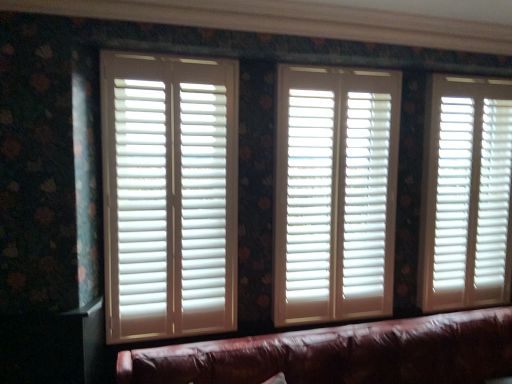
Question: Considering the relative sizes of white matte blinds at left, which appears as the third window blind when viewed from the right, and white matte blinds at right, which is the third window blind in left-to-right order, in the image provided, is white matte blinds at left, which appears as the third window blind when viewed from the right, taller than white matte blinds at right, which is the third window blind in left-to-right order,?

Choices:
 (A) no
 (B) yes

Answer: (A)

Question: Is white matte blinds at left, the first window blind in the left-to-right sequence, outside white matte blinds at right, which is the third window blind in left-to-right order?

Choices:
 (A) no
 (B) yes

Answer: (B)

Question: From a real-world perspective, is white matte blinds at left, the first window blind in the left-to-right sequence, physically below white matte blinds at right, which appears as the 1th window blind when viewed from the right?

Choices:
 (A) yes
 (B) no

Answer: (B)

Question: From the image's perspective, is white matte blinds at left, which appears as the third window blind when viewed from the right, under white matte blinds at right, which is the third window blind in left-to-right order?

Choices:
 (A) no
 (B) yes

Answer: (B)

Question: From a real-world perspective, does white matte blinds at left, which appears as the third window blind when viewed from the right, stand above white matte blinds at right, which appears as the 1th window blind when viewed from the right?

Choices:
 (A) no
 (B) yes

Answer: (B)

Question: Considering their positions, is white matte blinds at right, which appears as the 1th window blind when viewed from the right, located in front of or behind white matte blinds at left, the first window blind in the left-to-right sequence?

Choices:
 (A) front
 (B) behind

Answer: (B)

Question: Visually, is white matte blinds at right, which appears as the 1th window blind when viewed from the right, positioned to the left or to the right of white matte blinds at left, the first window blind in the left-to-right sequence?

Choices:
 (A) right
 (B) left

Answer: (A)

Question: Considering the positions of white matte blinds at right, which is the third window blind in left-to-right order, and white matte blinds at left, which appears as the third window blind when viewed from the right, in the image, is white matte blinds at right, which is the third window blind in left-to-right order, wider or thinner than white matte blinds at left, which appears as the third window blind when viewed from the right,?

Choices:
 (A) thin
 (B) wide

Answer: (B)

Question: From a real-world perspective, is white matte blinds at right, which is the third window blind in left-to-right order, physically located above or below white matte blinds at left, which appears as the third window blind when viewed from the right?

Choices:
 (A) above
 (B) below

Answer: (B)

Question: Does point (195, 87) appear closer or farther from the camera than point (331, 306)?

Choices:
 (A) farther
 (B) closer

Answer: (B)

Question: Considering their positions, is white matte blinds at left, the first window blind in the left-to-right sequence, located in front of or behind white matte wood blinds at center, which ranks as the second window blind in right-to-left order?

Choices:
 (A) front
 (B) behind

Answer: (A)

Question: In the image, is white matte blinds at left, which appears as the third window blind when viewed from the right, on the left side or the right side of white matte wood blinds at center, which ranks as the second window blind in right-to-left order?

Choices:
 (A) right
 (B) left

Answer: (B)

Question: Is white matte blinds at left, the first window blind in the left-to-right sequence, inside or outside of white matte wood blinds at center, which ranks as the second window blind in right-to-left order?

Choices:
 (A) inside
 (B) outside

Answer: (B)

Question: Does point (278, 130) appear closer or farther from the camera than point (490, 162)?

Choices:
 (A) farther
 (B) closer

Answer: (B)

Question: Visually, is white matte wood blinds at center, which ranks as the second window blind in right-to-left order, positioned to the left or to the right of white matte blinds at right, which appears as the 1th window blind when viewed from the right?

Choices:
 (A) left
 (B) right

Answer: (A)